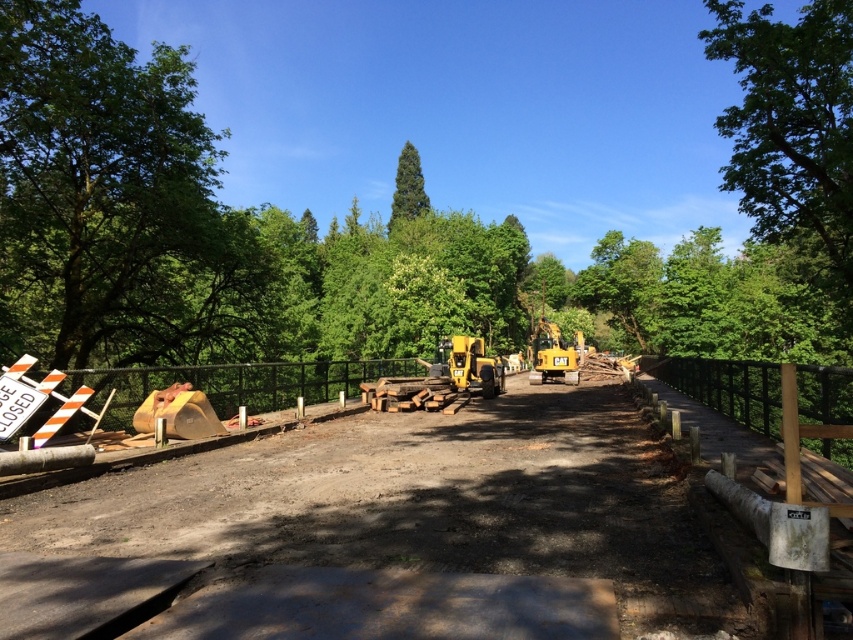
Does matte yellow construction equipment at center appear under yellow metallic excavator at center?

Indeed, matte yellow construction equipment at center is positioned under yellow metallic excavator at center.

Is matte yellow construction equipment at center positioned at the back of yellow metallic excavator at center?

No, matte yellow construction equipment at center is in front of yellow metallic excavator at center.

Where is `matte yellow construction equipment at center`? The width and height of the screenshot is (853, 640). matte yellow construction equipment at center is located at coordinates (386, 532).

Find the location of a particular element. This screenshot has height=640, width=853. matte yellow construction equipment at center is located at coordinates (386, 532).

Is yellow rubber excavator at center shorter than green matte tree at center?

Indeed, yellow rubber excavator at center has a lesser height compared to green matte tree at center.

Is point (480, 396) more distant than point (415, 157)?

That is False.

Who is more distant from viewer, (476, 346) or (402, 161)?

The point (402, 161) is more distant.

This screenshot has height=640, width=853. What are the coordinates of `yellow rubber excavator at center` in the screenshot? It's located at (474, 365).

Is matte yellow construction equipment at center shorter than green leafy tree at left?

Correct, matte yellow construction equipment at center is not as tall as green leafy tree at left.

Which is behind, point (439, 500) or point (115, 262)?

Positioned behind is point (115, 262).

This screenshot has width=853, height=640. Find the location of `matte yellow construction equipment at center`. matte yellow construction equipment at center is located at coordinates (386, 532).

Locate an element on the screen. The height and width of the screenshot is (640, 853). matte yellow construction equipment at center is located at coordinates click(x=386, y=532).